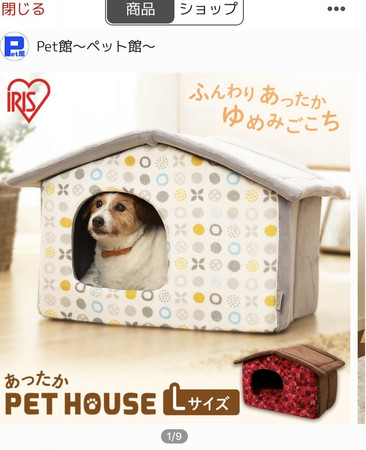
I want to click on entrance, so click(125, 245), click(261, 384).